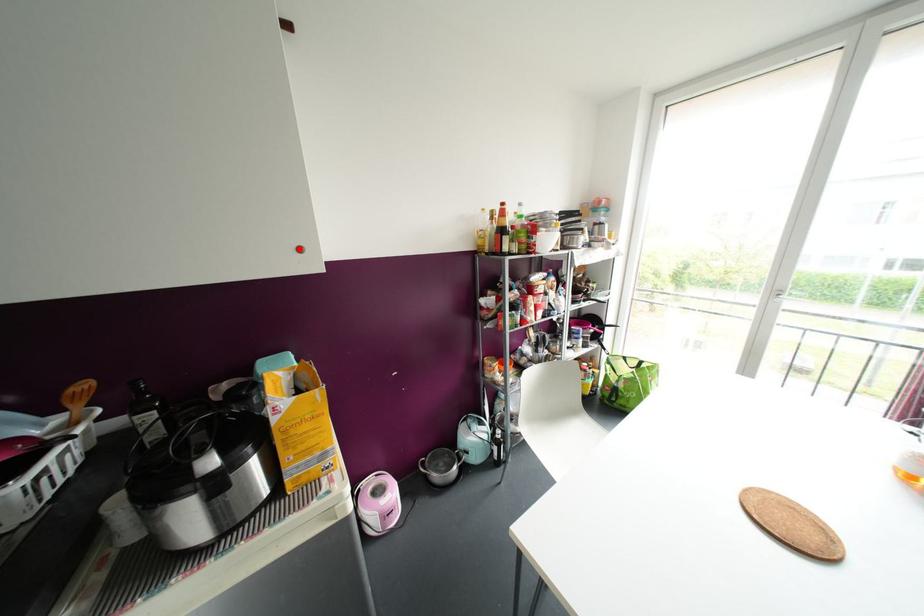
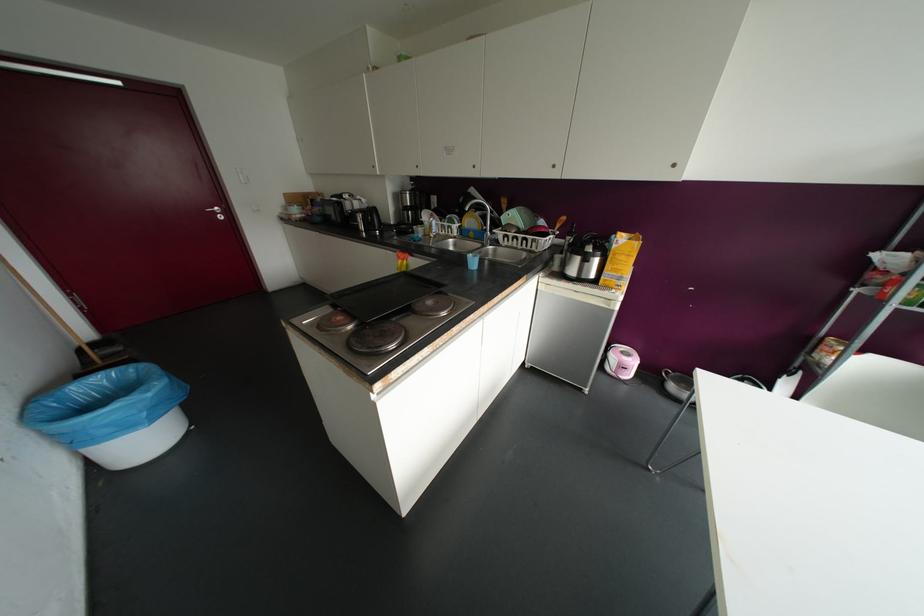
Locate, in the second image, the point that corresponds to the highlighted location in the first image.

(673, 164)